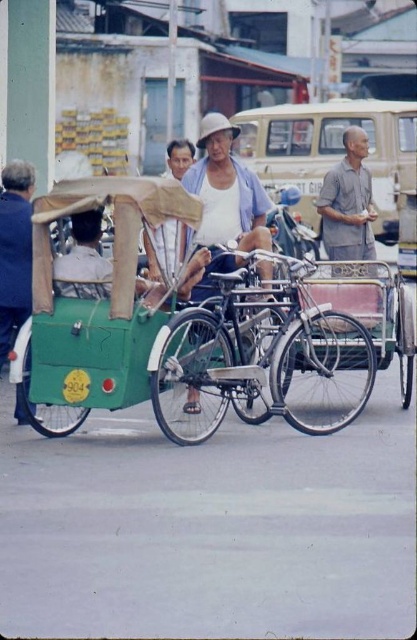
Question: Which point is farther to the camera?

Choices:
 (A) gray cotton shirt at center
 (B) green matte tricycle at center

Answer: (A)

Question: Which point is closer to the camera?

Choices:
 (A) gray cotton shirt at center
 (B) green fabric cart at left

Answer: (B)

Question: Can you confirm if green matte tricycle at center is thinner than blue fabric shirt at left?

Choices:
 (A) no
 (B) yes

Answer: (A)

Question: Which object is the closest to the blue fabric shirt at left?

Choices:
 (A) white cotton hat at center
 (B) green fabric cart at left
 (C) green matte tricycle at center

Answer: (B)

Question: Can you confirm if silver metallic bicycle at center is thinner than blue fabric shirt at left?

Choices:
 (A) no
 (B) yes

Answer: (A)

Question: Does green matte tricycle at center have a larger size compared to white cotton hat at center?

Choices:
 (A) yes
 (B) no

Answer: (A)